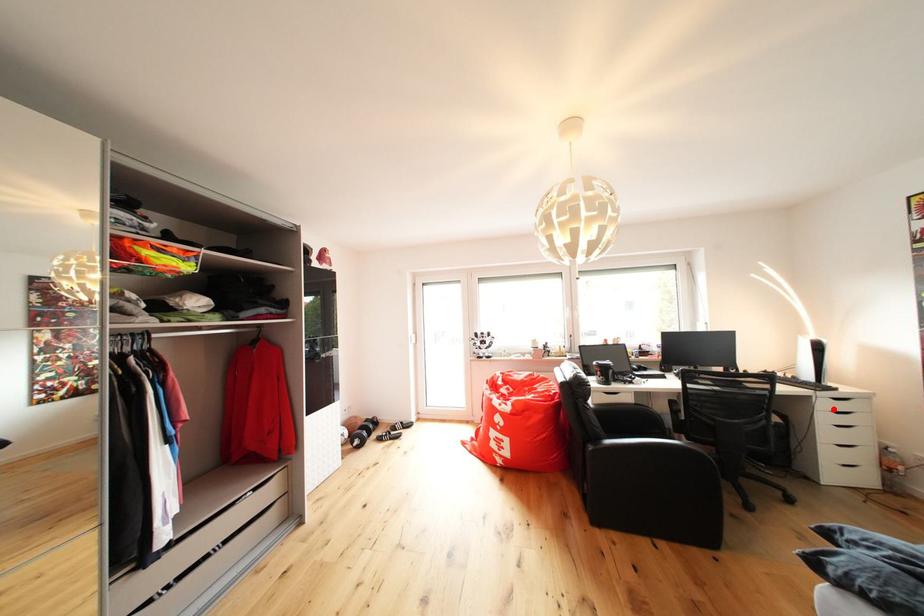
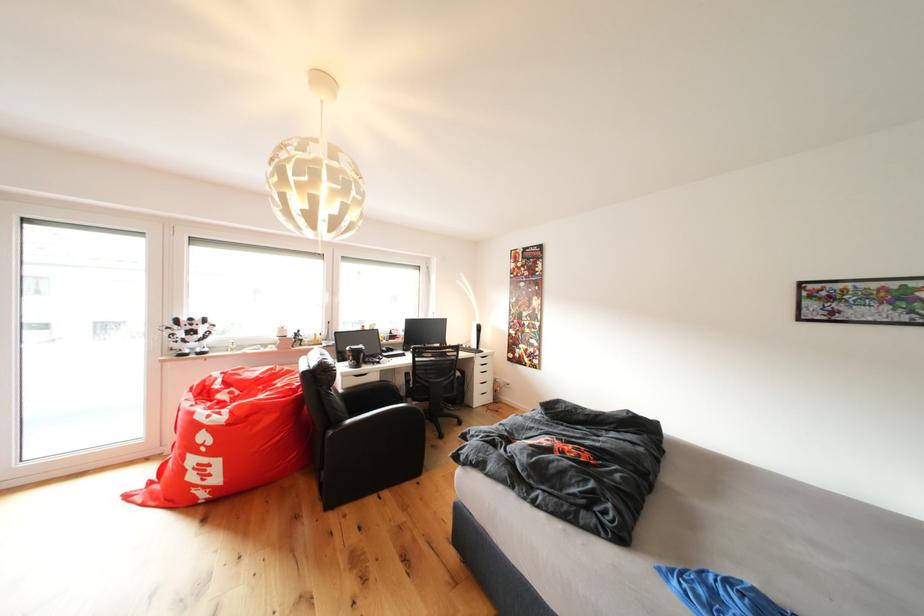
Locate, in the second image, the point that corresponds to the highlighted location in the first image.

(487, 366)